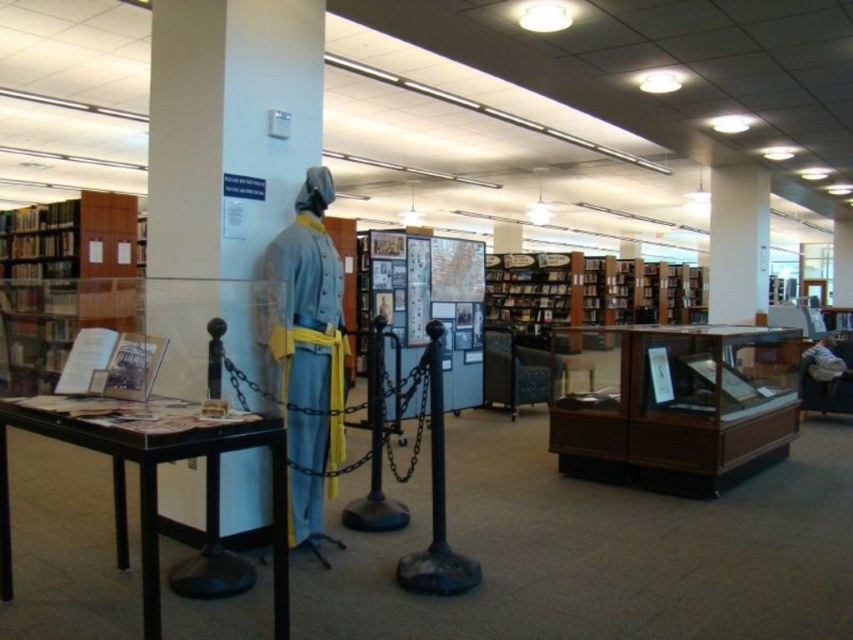
Is wooden display case at center further to camera compared to wooden bookshelf at left?

No, wooden display case at center is in front of wooden bookshelf at left.

Can you confirm if wooden display case at center is positioned to the right of wooden bookshelf at left?

Correct, you'll find wooden display case at center to the right of wooden bookshelf at left.

Describe the element at coordinates (672, 403) in the screenshot. I see `wooden display case at center` at that location.

You are a GUI agent. You are given a task and a screenshot of the screen. Output one action in this format:
    pyautogui.click(x=<x>, y=<y>)
    Task: Click on the wooden display case at center
    The image size is (853, 640).
    Given the screenshot: What is the action you would take?
    pyautogui.click(x=672, y=403)

Does point (775, 364) come closer to viewer compared to point (820, 374)?

Yes, it is in front of point (820, 374).

Is point (750, 433) in front of point (822, 337)?

Yes.

Find the location of a particular element. The width and height of the screenshot is (853, 640). wooden display case at center is located at coordinates (672, 403).

Is wooden display case at center to the left of black plastic table at lower left from the viewer's perspective?

Incorrect, wooden display case at center is not on the left side of black plastic table at lower left.

Who is more forward, (717, 433) or (276, 509)?

Point (276, 509) is more forward.

Locate an element on the screen. The image size is (853, 640). wooden display case at center is located at coordinates (672, 403).